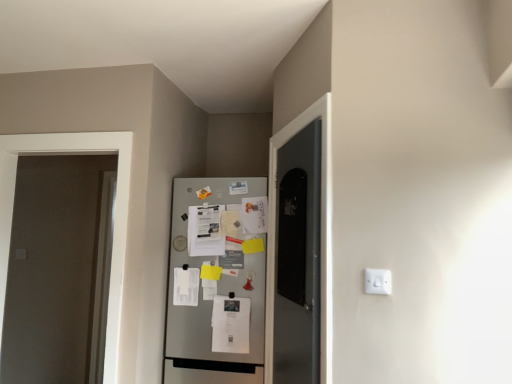
The height and width of the screenshot is (384, 512). What do you see at coordinates (52, 269) in the screenshot?
I see `white matte door at left` at bounding box center [52, 269].

Measure the distance between metallic silver refrigerator at center and camera.

The distance of metallic silver refrigerator at center from camera is 7.70 feet.

What do you see at coordinates (378, 281) in the screenshot?
I see `white plastic electric outlet at center right` at bounding box center [378, 281].

Identify the location of white matte door at left. The height and width of the screenshot is (384, 512). (52, 269).

From a real-world perspective, which object rests below the other?

metallic silver refrigerator at center is physically lower.

Can you confirm if white matte door at left is shorter than metallic silver refrigerator at center?

No.

How far apart are white matte door at left and metallic silver refrigerator at center?

white matte door at left is 1.42 meters away from metallic silver refrigerator at center.

What's the angular difference between white matte door at left and metallic silver refrigerator at center's facing directions?

The facing directions of white matte door at left and metallic silver refrigerator at center are 0.972 degrees apart.

Considering the positions of objects metallic silver refrigerator at center and white plastic electric outlet at center right in the image provided, who is more to the right, metallic silver refrigerator at center or white plastic electric outlet at center right?

white plastic electric outlet at center right.

How much distance is there between metallic silver refrigerator at center and white plastic electric outlet at center right?

They are 1.17 meters apart.

Looking at this image, considering the relative sizes of metallic silver refrigerator at center and white plastic electric outlet at center right in the image provided, is metallic silver refrigerator at center taller than white plastic electric outlet at center right?

Yes.

What's the angular difference between metallic silver refrigerator at center and white plastic electric outlet at center right's facing directions?

The angle between the facing direction of metallic silver refrigerator at center and the facing direction of white plastic electric outlet at center right is 0.728 degrees.

The height and width of the screenshot is (384, 512). I want to click on electric outlet above the white matte door at left (from the image's perspective), so click(x=378, y=281).

Does point (386, 285) appear closer or farther from the camera than point (60, 346)?

Clearly, point (386, 285) is closer to the camera than point (60, 346).

Can you confirm if white plastic electric outlet at center right is smaller than white matte door at left?

Yes.

Which of these two, white plastic electric outlet at center right or white matte door at left, stands shorter?

white plastic electric outlet at center right.

Which is less distant, (247, 196) or (22, 316)?

Point (247, 196) appears to be closer to the viewer than point (22, 316).

The image size is (512, 384). What are the coordinates of `refrigerator that is under the white matte door at left (from a real-world perspective)` in the screenshot? It's located at (215, 282).

From a real-world perspective, between white matte door at left and white plastic electric outlet at center right, who is vertically higher?

In real-world perspective, white matte door at left is above.

Choose the correct answer: Is white matte door at left inside white plastic electric outlet at center right or outside it?

white matte door at left exists outside the volume of white plastic electric outlet at center right.

Is white matte door at left not near white plastic electric outlet at center right?

Yes, white matte door at left is far from white plastic electric outlet at center right.

Considering the positions of points (385, 278) and (244, 266), is point (385, 278) farther from camera compared to point (244, 266)?

That is False.

Is white plastic electric outlet at center right to the left of metallic silver refrigerator at center from the viewer's perspective?

In fact, white plastic electric outlet at center right is to the right of metallic silver refrigerator at center.

Is white plastic electric outlet at center right facing towards metallic silver refrigerator at center?

No, white plastic electric outlet at center right is not oriented towards metallic silver refrigerator at center.

Considering the positions of objects white plastic electric outlet at center right and metallic silver refrigerator at center in the image provided, who is in front, white plastic electric outlet at center right or metallic silver refrigerator at center?

white plastic electric outlet at center right is more forward.

The height and width of the screenshot is (384, 512). I want to click on door above the metallic silver refrigerator at center (from the image's perspective), so click(x=52, y=269).

Locate an element on the screen. The height and width of the screenshot is (384, 512). refrigerator that appears below the white plastic electric outlet at center right (from a real-world perspective) is located at coordinates (215, 282).

From the image, which object appears to be farther from white plastic electric outlet at center right, white matte door at left or metallic silver refrigerator at center?

white matte door at left is positioned further to the anchor white plastic electric outlet at center right.

Consider the image. Which object lies nearer to the anchor point metallic silver refrigerator at center, white matte door at left or white plastic electric outlet at center right?

white plastic electric outlet at center right is closer to metallic silver refrigerator at center.

Based on their spatial positions, is metallic silver refrigerator at center or white matte door at left further from white plastic electric outlet at center right?

Among the two, white matte door at left is located further to white plastic electric outlet at center right.

Which object lies nearer to the anchor point white matte door at left, white plastic electric outlet at center right or metallic silver refrigerator at center?

Based on the image, metallic silver refrigerator at center appears to be nearer to white matte door at left.

From the image, which object appears to be nearer to white matte door at left, metallic silver refrigerator at center or white plastic electric outlet at center right?

metallic silver refrigerator at center is positioned closer to the anchor white matte door at left.

Based on their spatial positions, is white plastic electric outlet at center right or white matte door at left further from metallic silver refrigerator at center?

white matte door at left.

At what (x,y) coordinates should I click in order to perform the action: click on refrigerator between white matte door at left and white plastic electric outlet at center right in the horizontal direction. Please return your answer as a coordinate pair (x, y). This screenshot has width=512, height=384. Looking at the image, I should click on (215, 282).